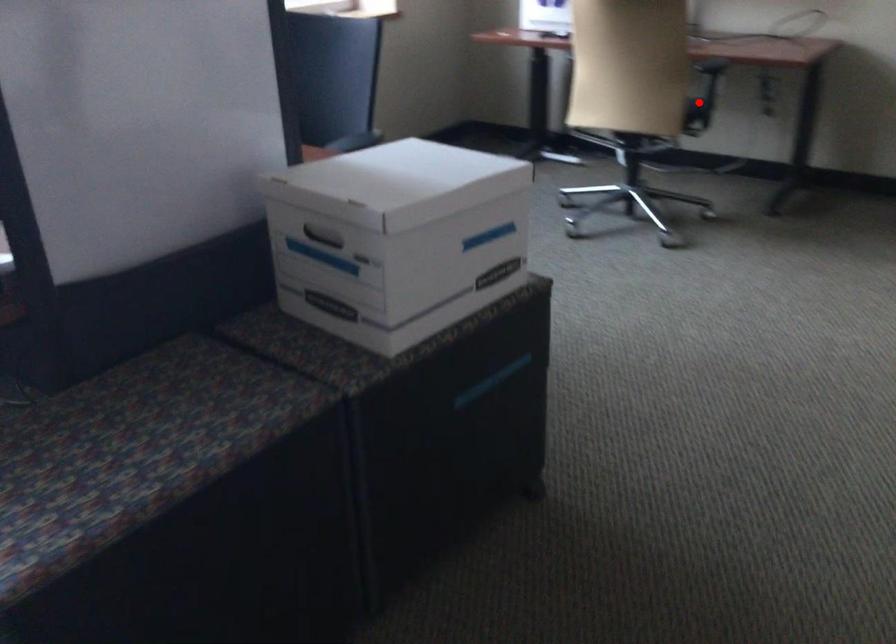
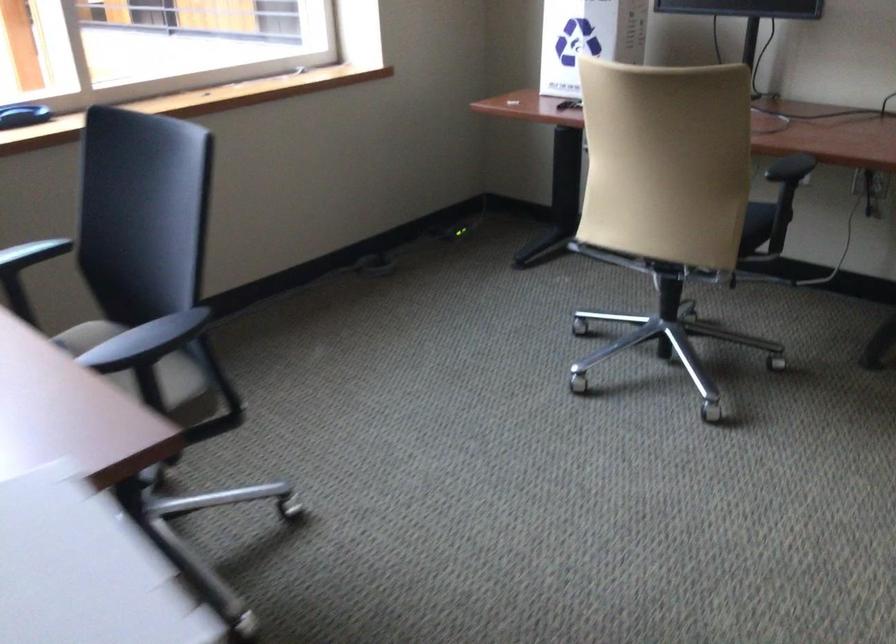
In the second image, find the point that corresponds to the highlighted location in the first image.

(755, 225)